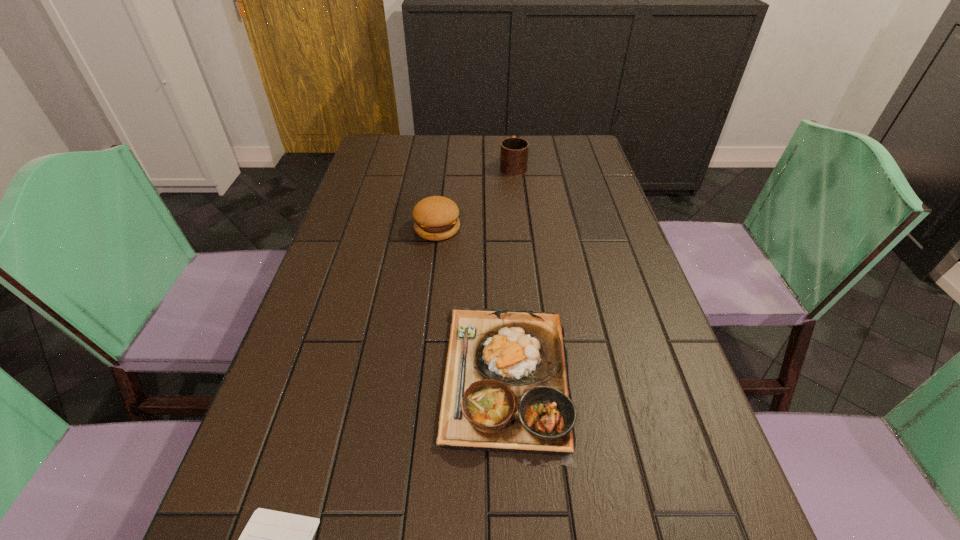
In the image, there is a desktop. Where is `vacant region at the left edge`? The height and width of the screenshot is (540, 960). vacant region at the left edge is located at coordinates (324, 273).

The height and width of the screenshot is (540, 960). I want to click on blank space at the right edge of the desktop, so click(x=605, y=340).

You are a GUI agent. You are given a task and a screenshot of the screen. Output one action in this format:
    pyautogui.click(x=<x>, y=<y>)
    Task: Click on the free space at the far left corner
    This screenshot has width=960, height=540.
    Given the screenshot: What is the action you would take?
    pyautogui.click(x=394, y=159)

Locate an element on the screen. This screenshot has height=540, width=960. vacant space at the far right corner of the desktop is located at coordinates (550, 163).

Identify the location of free spot between the platter and the mug. (509, 271).

Find the location of a particular element. The height and width of the screenshot is (540, 960). free spot between the hamburger and the second nearest object is located at coordinates (471, 302).

This screenshot has width=960, height=540. Find the location of `vacant area that lies between the second farthest object and the third tallest object`. vacant area that lies between the second farthest object and the third tallest object is located at coordinates (471, 302).

This screenshot has height=540, width=960. Find the location of `free space between the hamburger and the second nearest object`. free space between the hamburger and the second nearest object is located at coordinates (471, 302).

I want to click on free spot between the hamburger and the mug, so click(x=475, y=197).

This screenshot has width=960, height=540. Identify the location of vacant area that lies between the second shortest object and the farthest object. (509, 271).